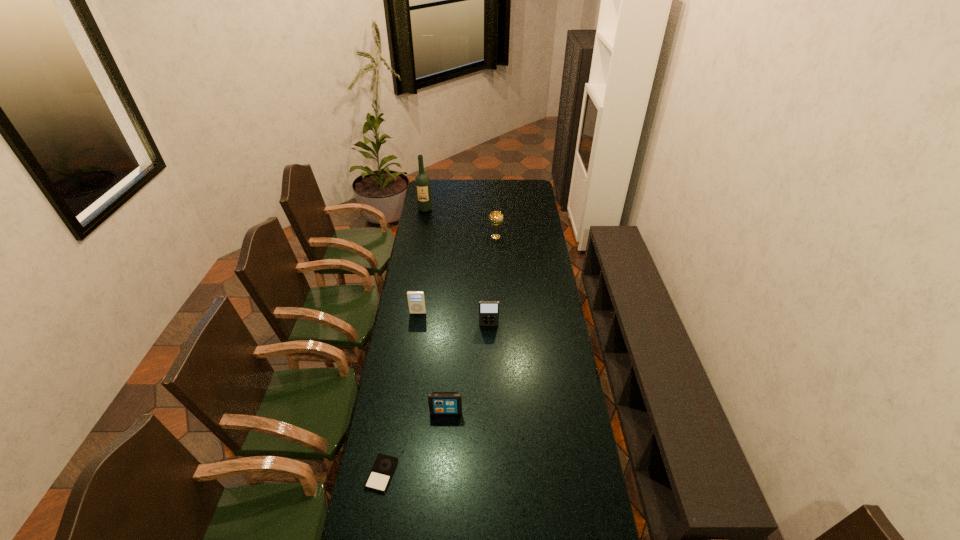
Identify the location of the farthest object. (422, 182).

The image size is (960, 540). I want to click on wine bottle, so click(422, 182).

Find the location of `the fifth nearest object`. the fifth nearest object is located at coordinates (496, 218).

Where is `the second farthest iPod`? the second farthest iPod is located at coordinates (488, 310).

Where is `the rightmost iPod`? the rightmost iPod is located at coordinates (488, 310).

Locate an element on the screen. Image resolution: width=960 pixels, height=540 pixels. the farthest iPod is located at coordinates pos(416,300).

You are a GUI agent. You are given a task and a screenshot of the screen. Output one action in this format:
    pyautogui.click(x=<x>, y=<y>)
    Task: Click on the second iPod from right to left
    
    Given the screenshot: What is the action you would take?
    pyautogui.click(x=440, y=403)

You are a GUI agent. You are given a task and a screenshot of the screen. Output one action in this format:
    pyautogui.click(x=<x>, y=<y>)
    Task: Click on the second nearest object
    Image resolution: width=960 pixels, height=540 pixels.
    Given the screenshot: What is the action you would take?
    pyautogui.click(x=440, y=403)

Image resolution: width=960 pixels, height=540 pixels. Identify the location of the nearest object. (384, 466).

Identify the location of the nearest iPod. This screenshot has width=960, height=540. (384, 466).